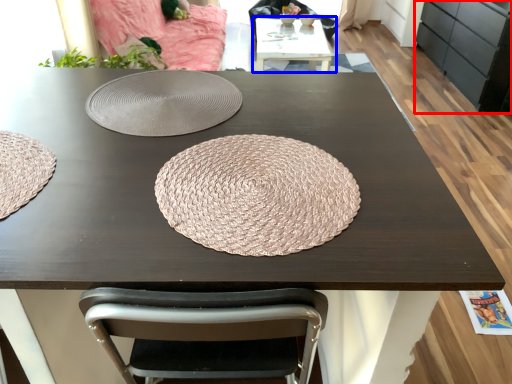
Question: Which object appears farthest to the camera in this image, cabinetry (highlighted by a red box) or table (highlighted by a blue box)?

Choices:
 (A) cabinetry
 (B) table

Answer: (B)